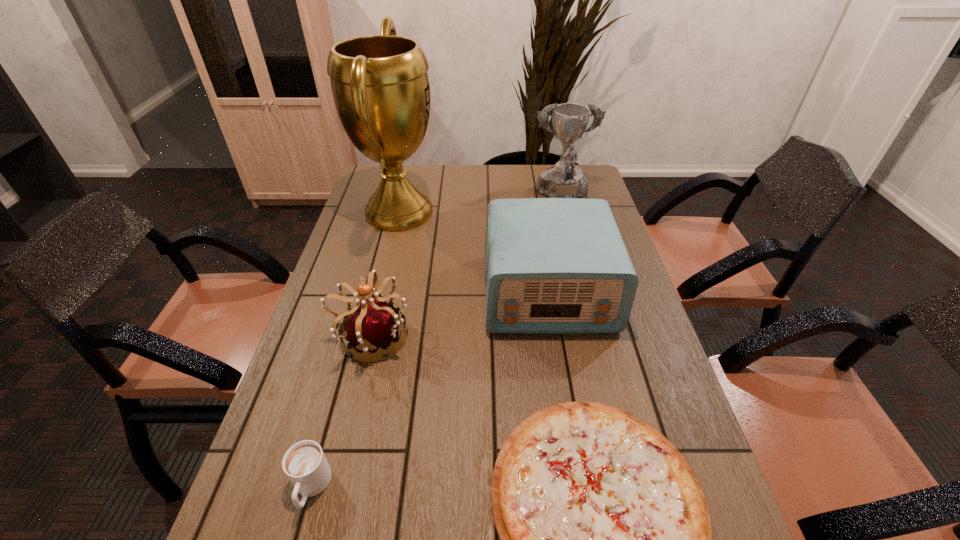
Locate an element on the screen. free space that satisfies the following two spatial constraints: 1. on the front panel of the radio receiver; 2. on the front-facing side of the tiara is located at coordinates (556, 336).

Identify the location of vacant space that satisfies the following two spatial constraints: 1. on the side with emblem of the fifth shortest object; 2. on the front-facing side of the tiara. (598, 336).

The width and height of the screenshot is (960, 540). Find the location of `free region that satisfies the following two spatial constraints: 1. on the side with emblem of the award; 2. on the front-facing side of the tiara`. free region that satisfies the following two spatial constraints: 1. on the side with emblem of the award; 2. on the front-facing side of the tiara is located at coordinates (598, 336).

Locate an element on the screen. vacant point that satisfies the following two spatial constraints: 1. on the side with emblem of the second tallest object; 2. on the surface of the trophy cup with symbols is located at coordinates (566, 212).

The image size is (960, 540). I want to click on vacant space that satisfies the following two spatial constraints: 1. on the front-facing side of the tiara; 2. on the side with the handle of the cappuccino, so click(x=335, y=488).